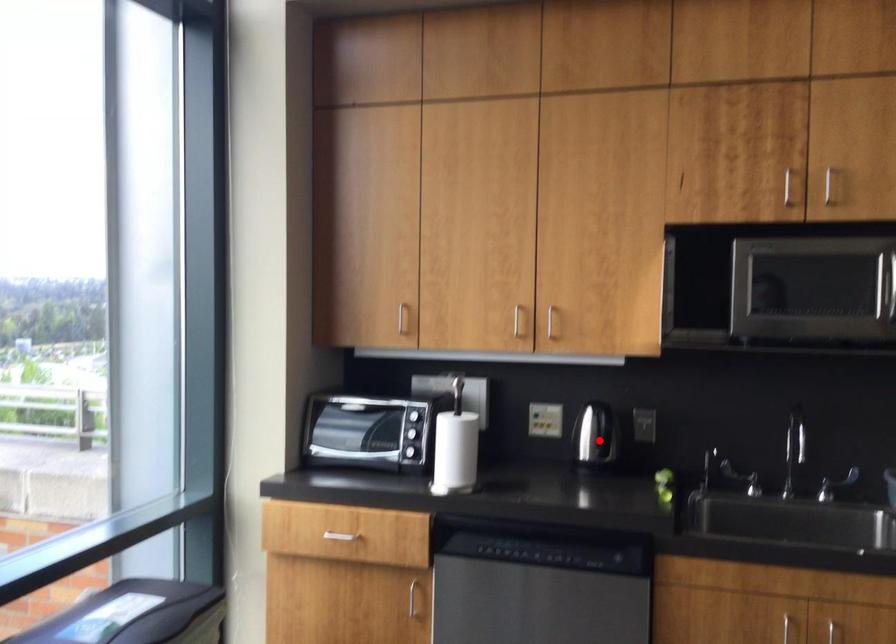
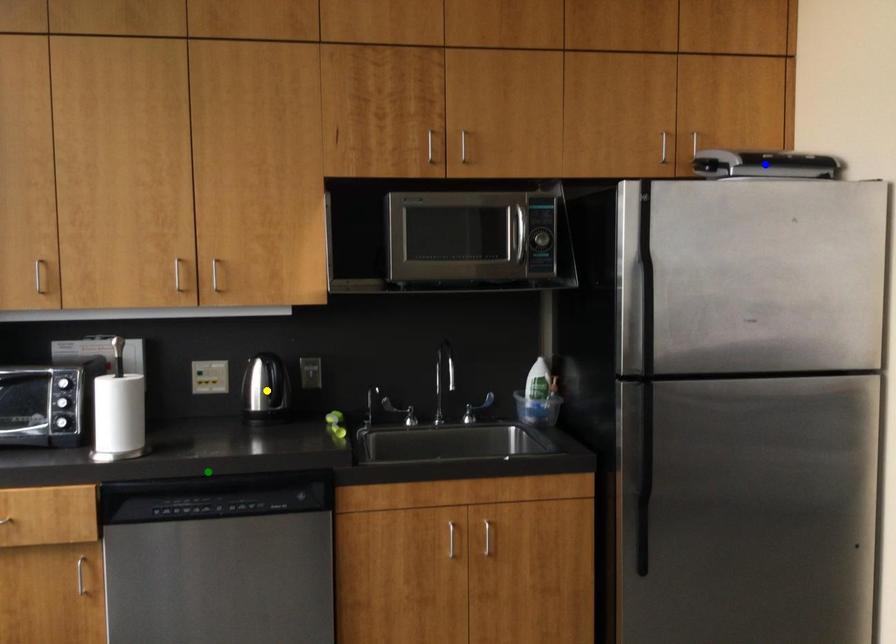
Question: I am providing you with two images of the same scene from different viewpoints. A red point is marked on the first image. You are given multiple points on the second image. Which spot in image 2 lines up with the point in image 1?

Choices:
 (A) yellow point
 (B) green point
 (C) blue point

Answer: (A)